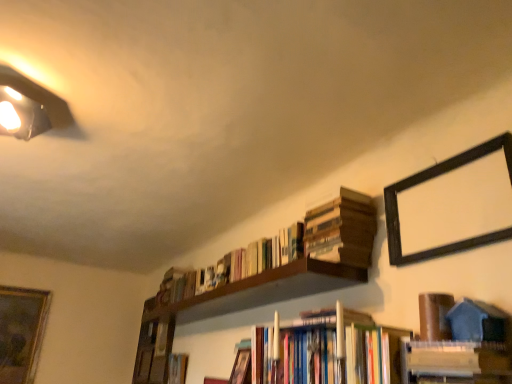
Question: From a real-world perspective, is brown matte book at upper right, positioned as the 5th book in back-to-front order, under hardcover books at center, the 6th book from the back?

Choices:
 (A) no
 (B) yes

Answer: (A)

Question: Can you confirm if brown matte book at upper right, positioned as the 5th book in back-to-front order, is bigger than hardcover books at center, which ranks as the 2th book in front-to-back order?

Choices:
 (A) yes
 (B) no

Answer: (B)

Question: Is brown matte book at upper right, positioned as the 5th book in back-to-front order, facing towards hardcover books at center, the 6th book from the back?

Choices:
 (A) yes
 (B) no

Answer: (B)

Question: Would you say hardcover books at center, which ranks as the 2th book in front-to-back order, is part of brown matte book at upper right, placed as the 3th book when sorted from front to back,'s contents?

Choices:
 (A) yes
 (B) no

Answer: (B)

Question: Is brown matte book at upper right, positioned as the 5th book in back-to-front order, at the left side of hardcover books at center, which ranks as the 2th book in front-to-back order?

Choices:
 (A) no
 (B) yes

Answer: (A)

Question: Would you say gold-framed painting at lower left, which ranks as the second picture frame in front-to-back order, is to the left or to the right of hardcover book at center, the seventh book positioned from the front, in the picture?

Choices:
 (A) left
 (B) right

Answer: (A)

Question: From a real-world perspective, is gold-framed painting at lower left, which ranks as the second picture frame in front-to-back order, physically located above or below hardcover book at center, the seventh book positioned from the front?

Choices:
 (A) below
 (B) above

Answer: (B)

Question: Is gold-framed painting at lower left, arranged as the 1th picture frame when viewed from the back, taller or shorter than hardcover book at center, the seventh book positioned from the front?

Choices:
 (A) short
 (B) tall

Answer: (B)

Question: In terms of size, does gold-framed painting at lower left, which ranks as the second picture frame in front-to-back order, appear bigger or smaller than hardcover book at center, which is the 1th book from back to front?

Choices:
 (A) big
 (B) small

Answer: (A)

Question: In terms of size, does wooden bookshelf at lower left appear bigger or smaller than brown matte book at upper right, positioned as the 5th book in back-to-front order?

Choices:
 (A) big
 (B) small

Answer: (A)

Question: Would you say wooden bookshelf at lower left is to the left or to the right of brown matte book at upper right, positioned as the 5th book in back-to-front order, in the picture?

Choices:
 (A) left
 (B) right

Answer: (A)

Question: Is wooden bookshelf at lower left wider or thinner than brown matte book at upper right, positioned as the 5th book in back-to-front order?

Choices:
 (A) wide
 (B) thin

Answer: (B)

Question: From the image's perspective, is wooden bookshelf at lower left located above or below brown matte book at upper right, positioned as the 5th book in back-to-front order?

Choices:
 (A) above
 (B) below

Answer: (B)

Question: From the image's perspective, is wooden book at upper right, placed as the fourth book when sorted from back to front, positioned above or below white glossy book at lower right, placed as the seventh book when sorted from back to front?

Choices:
 (A) above
 (B) below

Answer: (A)

Question: From a real-world perspective, is wooden book at upper right, placed as the fourth book when sorted from back to front, above or below white glossy book at lower right, placed as the seventh book when sorted from back to front?

Choices:
 (A) above
 (B) below

Answer: (A)